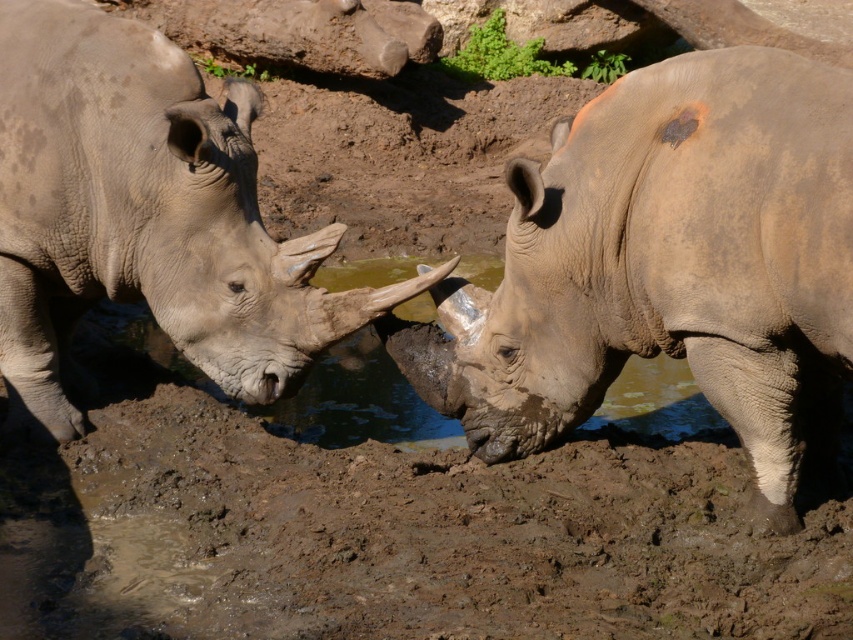
You are a wildlife photographer positioned at the origin point of the image. You want to capture a closeup shot of the gray textured rhino at center. According to the coordinates provided, in which direction should you move your camera to frame the rhino properly?

The gray textured rhino at center is located at coordinates 0.416 on the horizontal axis and 0.782 on the vertical axis. Since the origin point is at the bottom left corner of the image, you should move your camera to the right by 0.416 units and upwards by 0.782 units to frame the rhino properly.

You are a wildlife photographer observing two rhinos at a waterhole. You want to capture a photo where both the gray textured rhino at center and the gray matte rhinoceros at left are clearly visible. Based on their positions, which rhino is closer to the camera?

The gray textured rhino at center is closer to the camera because it is in front of the gray matte rhinoceros at left.

You are a wildlife photographer aiming to capture a closeup shot of both the gray textured rhino at center and the gray matte rhinoceros at left. Since your camera can only focus on one subject at a time, which rhino should you choose to ensure the background remains sharp? Explain your reasoning based on their sizes.

The gray textured rhino at center has a lesser width compared to the gray matte rhinoceros at left. To keep the background sharp, you should focus on the smaller gray textured rhino at center because smaller subjects allow for a deeper depth of field, making the background appear sharper.